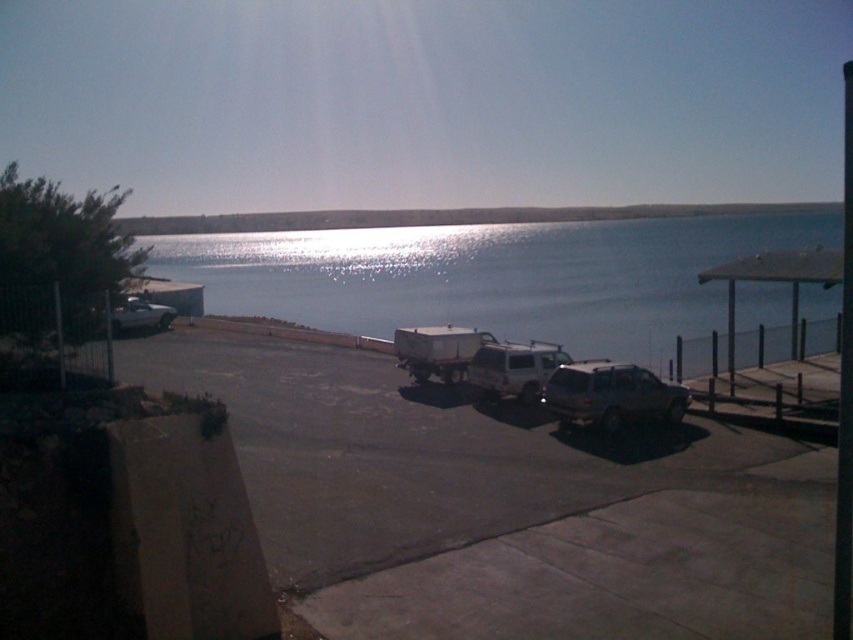
Question: Which object is positioned farthest from the blue water at center?

Choices:
 (A) white matte jeep at center
 (B) dark gray asphalt parking lot at center

Answer: (A)

Question: Observing the image, what is the correct spatial positioning of blue water at center in reference to satin silver suv at center?

Choices:
 (A) right
 (B) left

Answer: (A)

Question: Which point is closer to the camera?

Choices:
 (A) white matte truck at center
 (B) satin silver suv at center
 (C) white matte truck at left

Answer: (C)

Question: Which of these objects is positioned closest to the satin silver suv at center?

Choices:
 (A) white matte truck at center
 (B) blue water at center

Answer: (A)

Question: Can you confirm if white matte jeep at center is positioned to the right of white matte truck at left?

Choices:
 (A) yes
 (B) no

Answer: (A)

Question: Can you confirm if satin silver suv at center is thinner than white matte jeep at center?

Choices:
 (A) yes
 (B) no

Answer: (B)